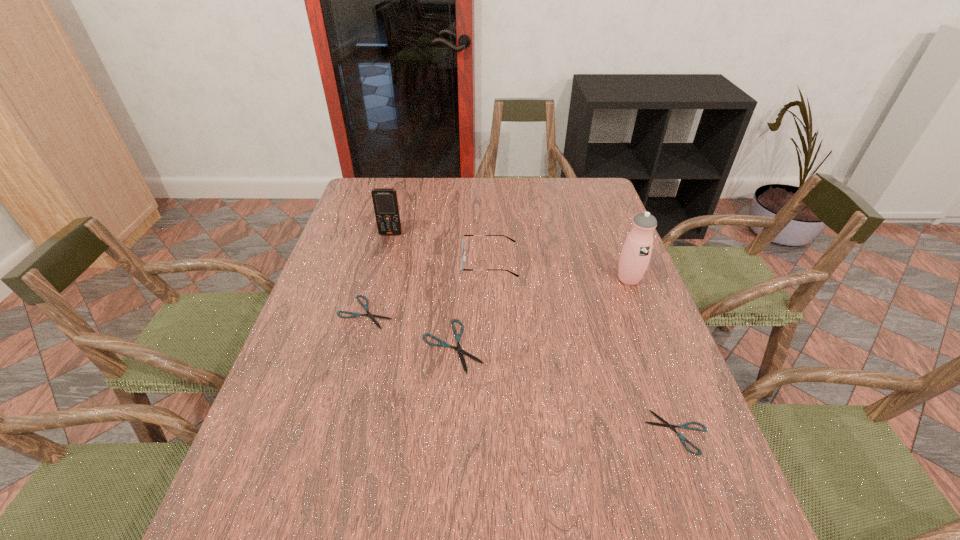
To make them evenly spaced by inserting another shears among them, please locate a vacant spot for this new shears. Please provide its 2D coordinates. Your answer should be formatted as a tuple, i.e. [(x, y)], where the tuple contains the x and y coordinates of a point satisfying the conditions above.

[(556, 385)]